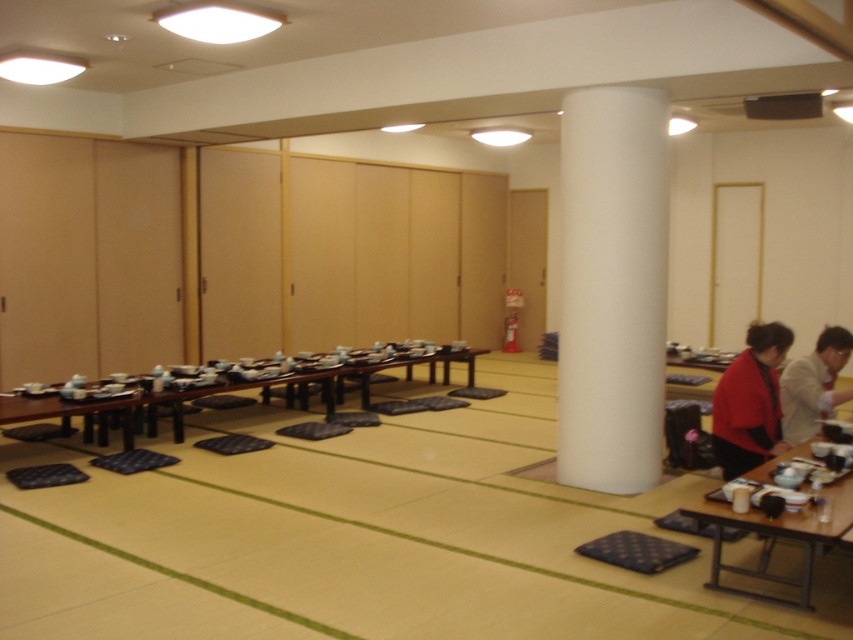
You are a guest arriving at a traditional Japanese tea ceremony. You see the matte red jacket at right and the dark blue textured mat at lower center. The host has asked you to place the jacket on the mat. Can you do this without moving more than 3 feet from your current position?

The distance between the matte red jacket at right and the dark blue textured mat at lower center is 3.48 feet, which is slightly more than 3 feet. Therefore, you cannot place the jacket on the mat without moving beyond the 3 feet limit.

You are a guest entering the room and see the matte red jacket at right and the dark blue textured mat at lower center. Which object is located to the right of the other?

The matte red jacket at right is positioned on the right side of the dark blue textured mat at lower center, so the matte red jacket at right is to the right of the dark blue textured mat at lower center.